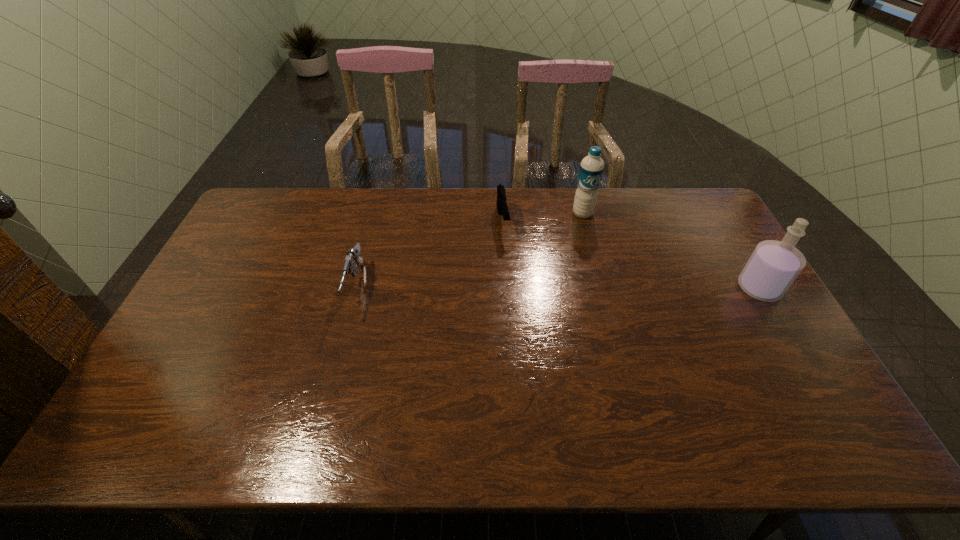
Locate an element on the screen. This screenshot has height=540, width=960. the leftmost object is located at coordinates (353, 258).

Find the location of a particular element. the rightmost object is located at coordinates (774, 265).

Identify the location of the second object from left to right. (502, 208).

Locate an element on the screen. The image size is (960, 540). water bottle is located at coordinates (591, 169).

The height and width of the screenshot is (540, 960). Find the location of `free space located at the barrel of the leftmost object`. free space located at the barrel of the leftmost object is located at coordinates (328, 390).

Find the location of `vacant space located on the left of the rightmost object`. vacant space located on the left of the rightmost object is located at coordinates (656, 288).

Where is `free location located 0.320m on the front-facing side of the third object from right to left`? This screenshot has height=540, width=960. free location located 0.320m on the front-facing side of the third object from right to left is located at coordinates (518, 312).

This screenshot has height=540, width=960. Find the location of `blank space located on the front-facing side of the third object from right to left`. blank space located on the front-facing side of the third object from right to left is located at coordinates (507, 255).

This screenshot has height=540, width=960. In order to click on vacant space located on the front-facing side of the third object from right to left in this screenshot , I will do `click(510, 266)`.

You are a GUI agent. You are given a task and a screenshot of the screen. Output one action in this format:
    pyautogui.click(x=<x>, y=<y>)
    Task: Click on the free space located 0.370m on the label of the second object from right to left
    The image size is (960, 540).
    Given the screenshot: What is the action you would take?
    pyautogui.click(x=617, y=298)